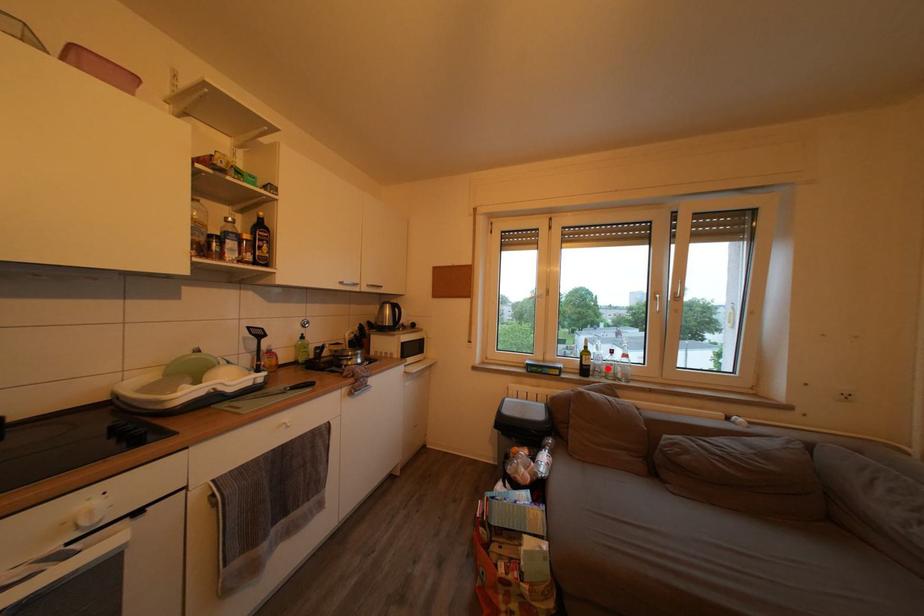
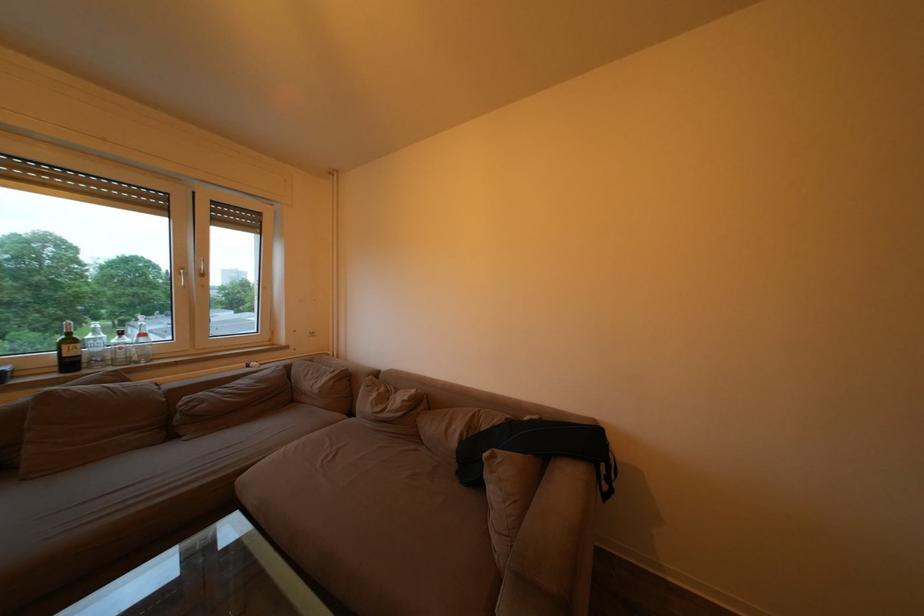
Where in the second image is the point corresponding to the highlighted location from the first image?

(107, 355)